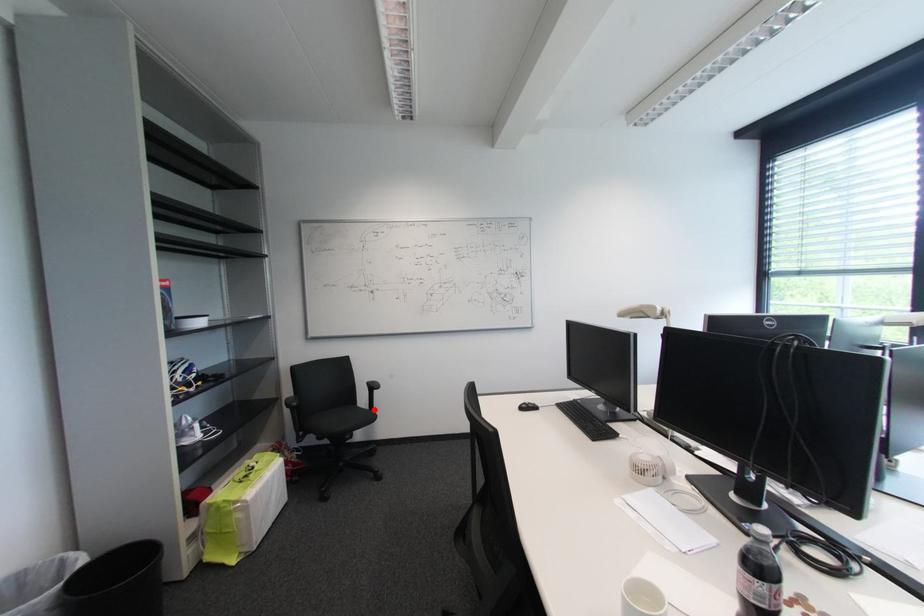
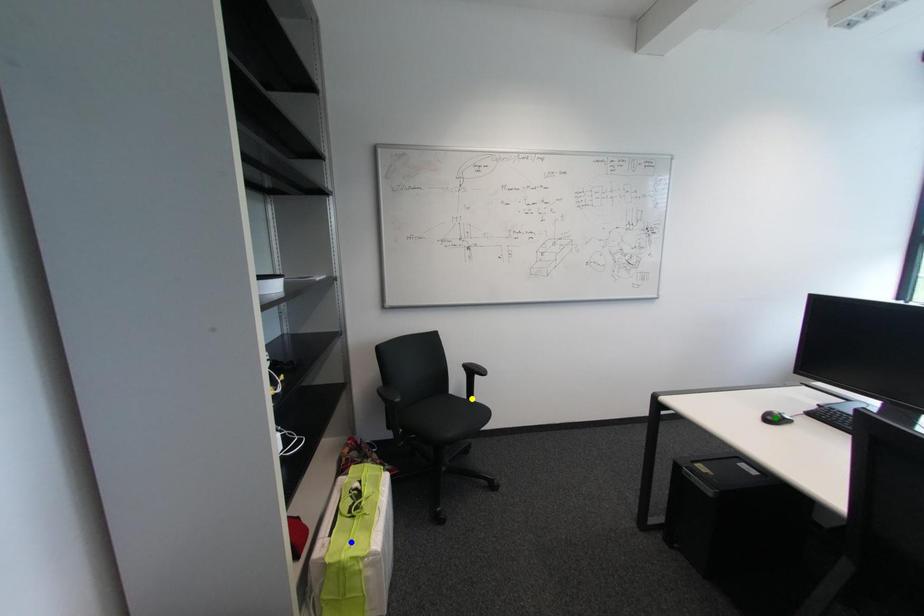
Question: I am providing you with two images of the same scene from different viewpoints. A red point is marked on the first image. You are given multiple points on the second image. Which mark in image 2 goes with the point in image 1?

Choices:
 (A) green point
 (B) yellow point
 (C) blue point

Answer: (B)